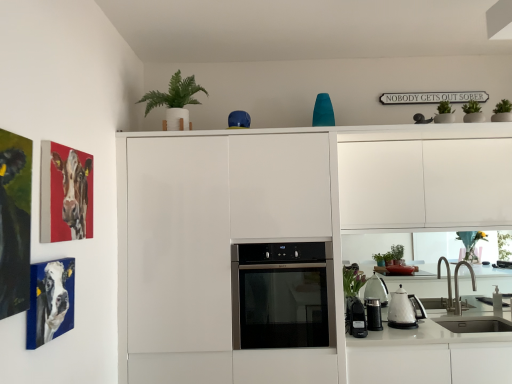
Question: Is black plastic power strip at lower right, the 1th appliance when ordered from left to right, further to camera compared to white glossy kettle at lower right?

Choices:
 (A) yes
 (B) no

Answer: (B)

Question: Is white glossy kettle at lower right located within black plastic power strip at lower right, which is the 2th appliance from right to left?

Choices:
 (A) no
 (B) yes

Answer: (A)

Question: Are black plastic power strip at lower right, which is the 2th appliance from right to left, and white glossy kettle at lower right making contact?

Choices:
 (A) yes
 (B) no

Answer: (B)

Question: Is black plastic power strip at lower right, the 1th appliance when ordered from left to right, far away from white glossy kettle at lower right?

Choices:
 (A) yes
 (B) no

Answer: (B)

Question: From a real-world perspective, is black plastic power strip at lower right, the 1th appliance when ordered from left to right, located beneath white glossy kettle at lower right?

Choices:
 (A) no
 (B) yes

Answer: (B)

Question: Is point (413, 299) closer or farther from the camera than point (154, 91)?

Choices:
 (A) farther
 (B) closer

Answer: (B)

Question: Based on their positions, is white glossy kettle at lower right located to the left or right of green matte plant at upper center?

Choices:
 (A) left
 (B) right

Answer: (B)

Question: Is white glossy kettle at lower right inside the boundaries of green matte plant at upper center, or outside?

Choices:
 (A) outside
 (B) inside

Answer: (A)

Question: Considering their positions, is white glossy kettle at lower right located in front of or behind green matte plant at upper center?

Choices:
 (A) front
 (B) behind

Answer: (B)

Question: From the image's perspective, is dark green matte painting at left, which is the 1th picture frame from front to back, above or below black plastic power strip at lower right, the 1th appliance when ordered from left to right?

Choices:
 (A) below
 (B) above

Answer: (B)

Question: From their relative heights in the image, would you say dark green matte painting at left, marked as the 3th picture frame in a back-to-front arrangement, is taller or shorter than black plastic power strip at lower right, the 1th appliance when ordered from left to right?

Choices:
 (A) tall
 (B) short

Answer: (A)

Question: Based on their sizes in the image, would you say dark green matte painting at left, which is the 1th picture frame from front to back, is bigger or smaller than black plastic power strip at lower right, which is the 2th appliance from right to left?

Choices:
 (A) small
 (B) big

Answer: (B)

Question: From a real-world perspective, is dark green matte painting at left, which is the 1th picture frame from front to back, physically located above or below black plastic power strip at lower right, which is the 2th appliance from right to left?

Choices:
 (A) below
 (B) above

Answer: (B)

Question: In terms of height, does matte canvas painting of cow at upper left, which is the first picture frame from back to front, look taller or shorter compared to metallic black coffee grinder at lower center, which is counted as the first appliance, starting from the right?

Choices:
 (A) tall
 (B) short

Answer: (A)

Question: Which is correct: matte canvas painting of cow at upper left, which is the first picture frame from back to front, is inside metallic black coffee grinder at lower center, acting as the second appliance starting from the left, or outside of it?

Choices:
 (A) inside
 (B) outside

Answer: (B)